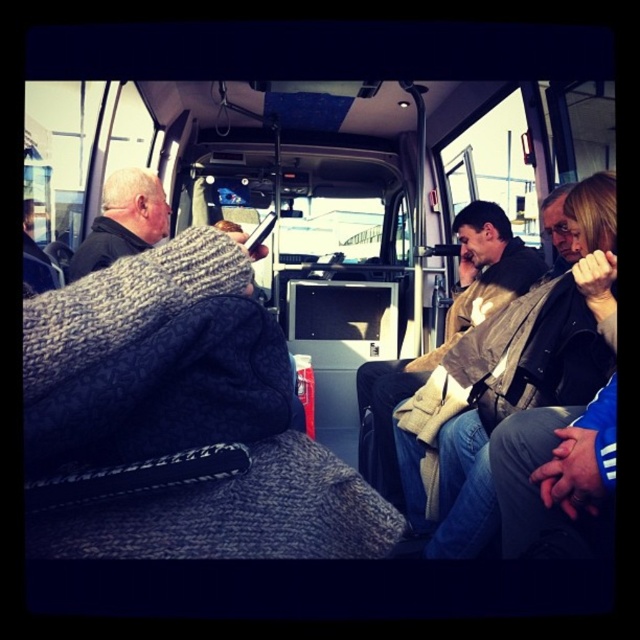
You are a passenger on a public bus and you have a knitted fabric bag at center and a black plastic phone at center. Which item is wider?

The knitted fabric bag at center is wider than the black plastic phone at center.

You are a passenger on a public bus and you want to place your knitted fabric bag at center and black plastic phone at center on the seat next to you. Can you stack them vertically without one falling over?

The knitted fabric bag at center is taller than the black plastic phone at center, so stacking them vertically might be unstable since the taller bag could cause the phone to tip over if not placed carefully.

You are a passenger on a public bus and need to reach your backpack located at the knitted fabric bag at center. If your arm can reach 50 centimeters, can you grab it without moving from your seat?

The knitted fabric bag at center is 48.95 centimeters away from the camera. Since your arm can reach 50 centimeters, you can grab it without moving from your seat.